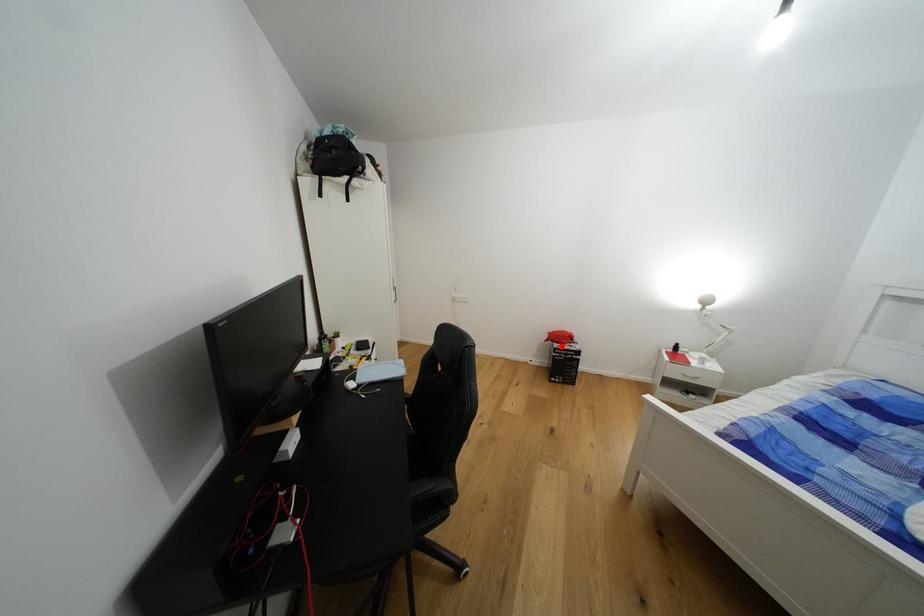
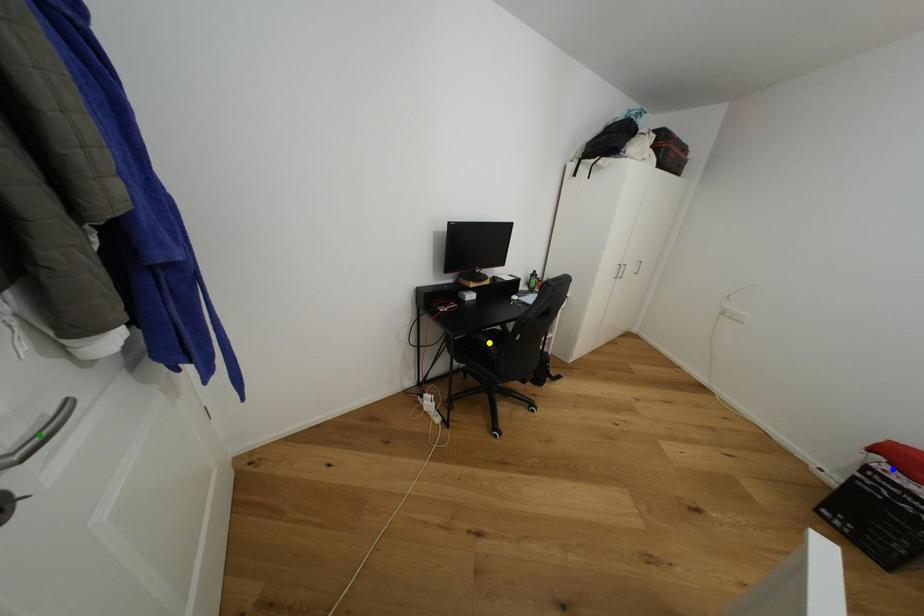
Question: I am providing you with two images of the same scene from different viewpoints. A red point is marked on the first image. You are given multiple points on the second image. Which point in image 2 is actually the same real-world point as the red point in image 1?

Choices:
 (A) yellow point
 (B) blue point
 (C) green point

Answer: (B)